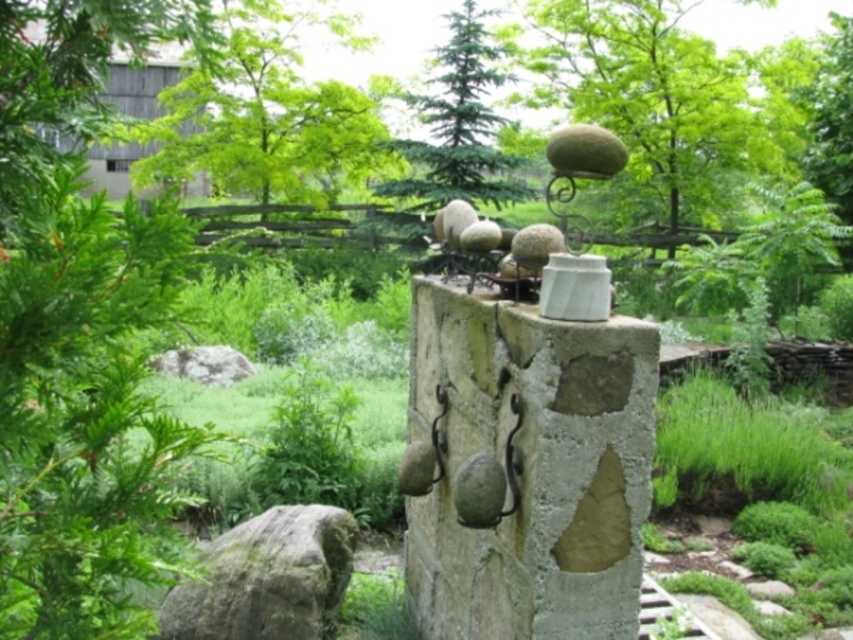
Who is higher up, green leafy tree at left or natural stone wall at center?

green leafy tree at left

The height and width of the screenshot is (640, 853). Describe the element at coordinates (78, 324) in the screenshot. I see `green leafy tree at left` at that location.

Describe the element at coordinates (78, 324) in the screenshot. I see `green leafy tree at left` at that location.

The image size is (853, 640). Find the location of `green leafy tree at left`. green leafy tree at left is located at coordinates (78, 324).

Is green leafy tree at left wider than green mossy rock at lower left?

Indeed, green leafy tree at left has a greater width compared to green mossy rock at lower left.

From the picture: Between green leafy tree at left and green mossy rock at lower left, which one is positioned higher?

Positioned higher is green leafy tree at left.

The width and height of the screenshot is (853, 640). Find the location of `green leafy tree at left`. green leafy tree at left is located at coordinates [x=78, y=324].

Locate an element on the screen. green leafy tree at left is located at coordinates (78, 324).

Between point (712, 204) and point (786, 138), which one is positioned behind?

Positioned behind is point (712, 204).

Which is more to the left, green textured sphere at upper center or green leafy tree at upper center?

green textured sphere at upper center

Who is more forward, (560, 67) or (782, 125)?

Point (782, 125)

Locate an element on the screen. green textured sphere at upper center is located at coordinates pyautogui.click(x=651, y=104).